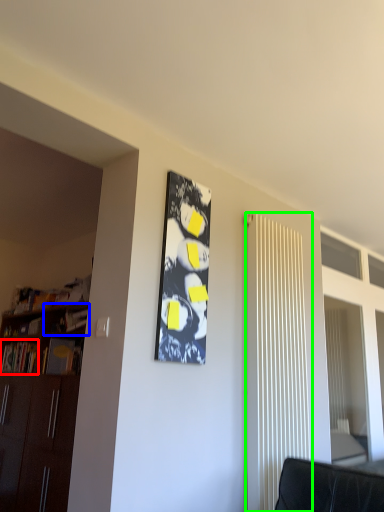
Question: Which object is the closest to the book (highlighted by a red box)? Choose among these: shelf (highlighted by a blue box) or radiator (highlighted by a green box).

Choices:
 (A) shelf
 (B) radiator

Answer: (A)